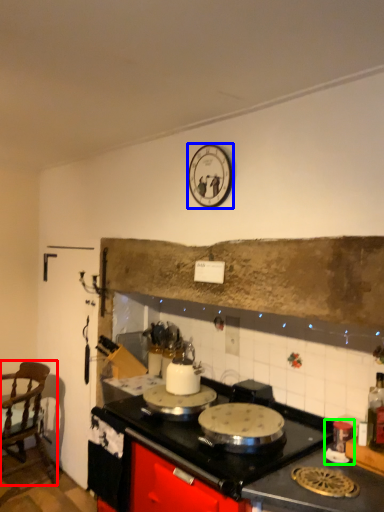
Question: Which is nearer to the chair (highlighted by a red box)? clock (highlighted by a blue box) or appliance (highlighted by a green box).

Choices:
 (A) clock
 (B) appliance

Answer: (A)